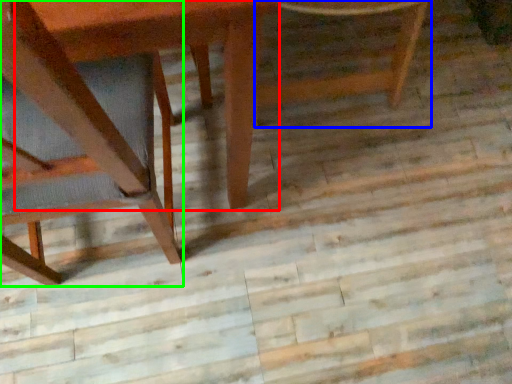
Question: Based on their relative distances, which object is farther from round table (highlighted by a red box)? Choose from chair (highlighted by a blue box) and chair (highlighted by a green box).

Choices:
 (A) chair
 (B) chair

Answer: (A)